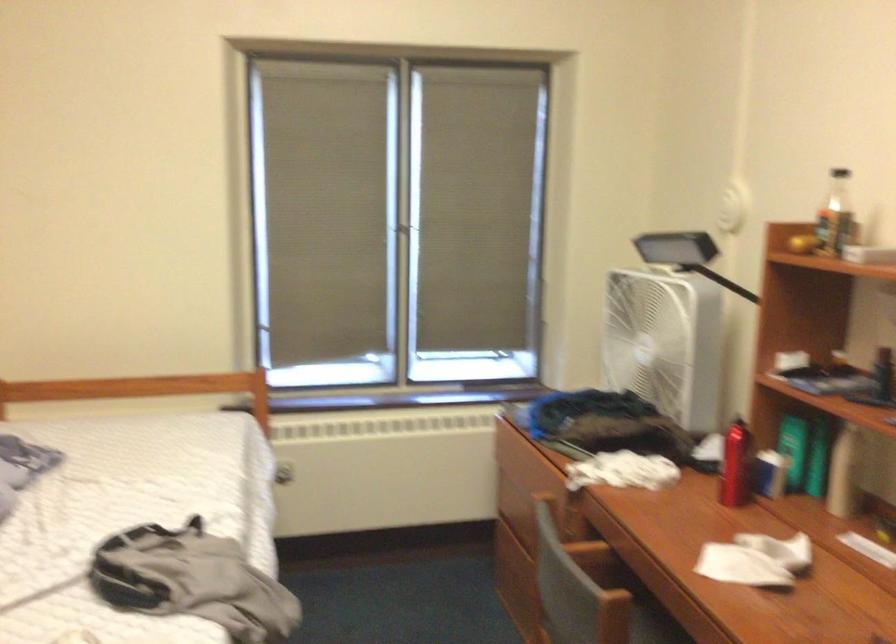
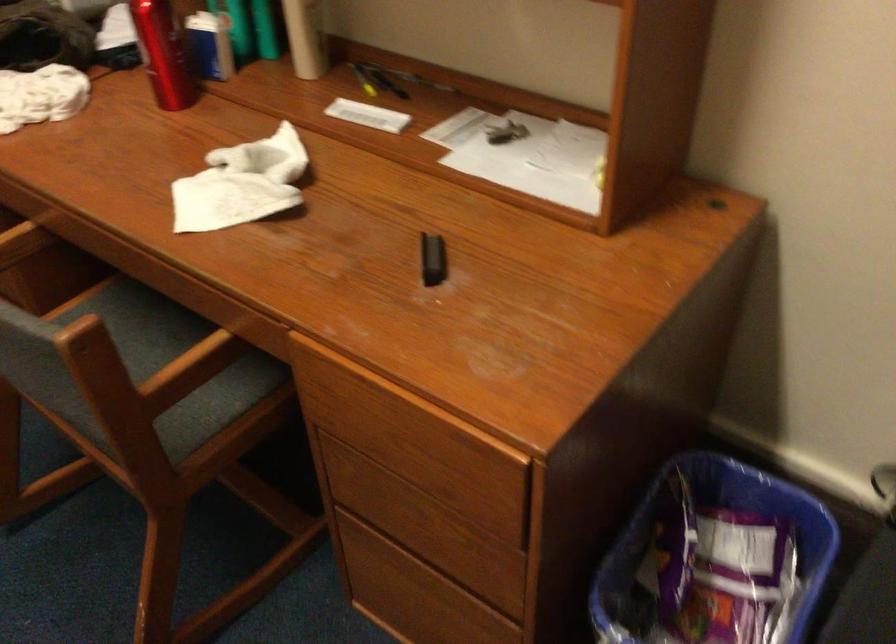
The first image is from the beginning of the video and the second image is from the end. How did the camera likely rotate when shooting the video?

The camera rotated toward right-down.